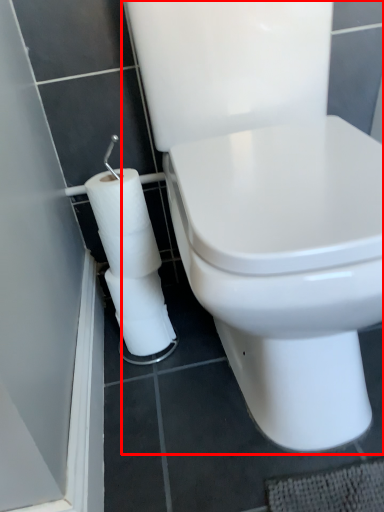
Question: From the image's perspective, what is the correct spatial relationship of toilet (annotated by the red box) in relation to toilet paper?

Choices:
 (A) below
 (B) above

Answer: (B)